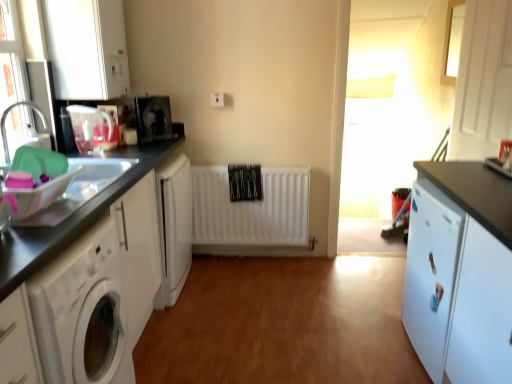
Question: Is white matte cabinet at upper left, the 3th cabinetry when ordered from right to left, shorter than white matte cabinet at left, arranged as the 2th cabinetry when viewed from the left?

Choices:
 (A) yes
 (B) no

Answer: (A)

Question: Is white matte cabinet at upper left, which is the 1th cabinetry in left-to-right order, taller than white matte cabinet at left, arranged as the 2th cabinetry when viewed from the left?

Choices:
 (A) yes
 (B) no

Answer: (B)

Question: From the image's perspective, is white matte cabinet at upper left, which is the 1th cabinetry in left-to-right order, below white matte cabinet at left, arranged as the 2th cabinetry when viewed from the left?

Choices:
 (A) yes
 (B) no

Answer: (B)

Question: From a real-world perspective, is white matte cabinet at upper left, which is the 1th cabinetry in left-to-right order, on white matte cabinet at left, the 2th cabinetry from the right?

Choices:
 (A) no
 (B) yes

Answer: (B)

Question: Considering the relative sizes of white matte cabinet at upper left, the 3th cabinetry when ordered from right to left, and white matte cabinet at left, arranged as the 2th cabinetry when viewed from the left, in the image provided, is white matte cabinet at upper left, the 3th cabinetry when ordered from right to left, bigger than white matte cabinet at left, arranged as the 2th cabinetry when viewed from the left,?

Choices:
 (A) yes
 (B) no

Answer: (B)

Question: From the image's perspective, is white plastic electric outlet at center located above or below white matte washing machine at left?

Choices:
 (A) below
 (B) above

Answer: (B)

Question: Is point (220, 100) positioned closer to the camera than point (101, 231)?

Choices:
 (A) farther
 (B) closer

Answer: (A)

Question: In the image, is white plastic electric outlet at center positioned in front of or behind white matte washing machine at left?

Choices:
 (A) behind
 (B) front

Answer: (A)

Question: Would you say white plastic electric outlet at center is inside or outside white matte washing machine at left?

Choices:
 (A) outside
 (B) inside

Answer: (A)

Question: From their relative heights in the image, would you say translucent plastic kettle at left, the 2th appliance when ordered from front to back, is taller or shorter than white matte washing machine at left?

Choices:
 (A) short
 (B) tall

Answer: (A)

Question: Looking at their shapes, would you say translucent plastic kettle at left, placed as the 2th appliance when sorted from back to front, is wider or thinner than white matte washing machine at left?

Choices:
 (A) thin
 (B) wide

Answer: (A)

Question: From a real-world perspective, is translucent plastic kettle at left, the 2th appliance when ordered from front to back, above or below white matte washing machine at left?

Choices:
 (A) above
 (B) below

Answer: (A)

Question: From the image's perspective, is translucent plastic kettle at left, the 2th appliance when ordered from front to back, located above or below white matte washing machine at left?

Choices:
 (A) above
 (B) below

Answer: (A)

Question: Does point (125, 162) appear closer or farther from the camera than point (106, 147)?

Choices:
 (A) closer
 (B) farther

Answer: (A)

Question: In terms of width, does translucent plastic sink at left look wider or thinner when compared to translucent plastic kettle at left, placed as the 2th appliance when sorted from back to front?

Choices:
 (A) wide
 (B) thin

Answer: (A)